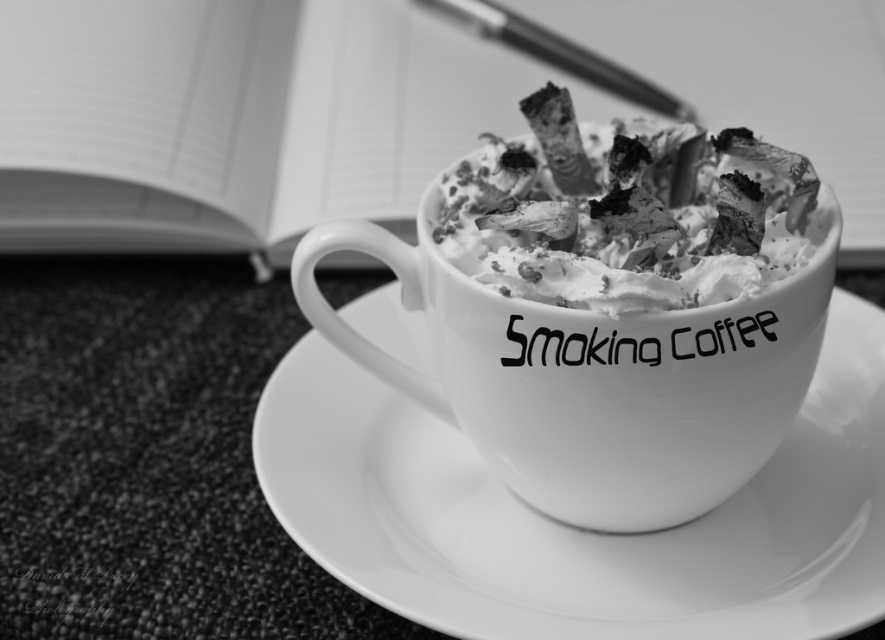
Question: Which is nearer to the charcoal-like ash at center?

Choices:
 (A) white matte mug at center
 (B) white glossy saucer at center
 (C) metallic silver pen at upper center

Answer: (A)

Question: Considering the real-world distances, which object is closest to the white matte mug at center?

Choices:
 (A) white glossy saucer at center
 (B) charcoal-like ash at center

Answer: (B)

Question: Is white glossy saucer at center thinner than metallic silver pen at upper center?

Choices:
 (A) yes
 (B) no

Answer: (B)

Question: Can you confirm if white glossy saucer at center is positioned above charcoal-like ash at center?

Choices:
 (A) no
 (B) yes

Answer: (A)

Question: Considering the real-world distances, which object is farthest from the metallic silver pen at upper center?

Choices:
 (A) white glossy saucer at center
 (B) charcoal-like ash at center

Answer: (A)

Question: In this image, where is white matte mug at center located relative to charcoal-like ash at center?

Choices:
 (A) below
 (B) above

Answer: (A)